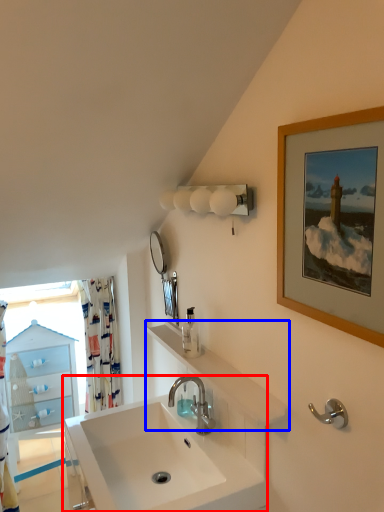
Question: Among these objects, which one is nearest to the camera, sink (highlighted by a red box) or counter top (highlighted by a blue box)?

Choices:
 (A) sink
 (B) counter top

Answer: (A)